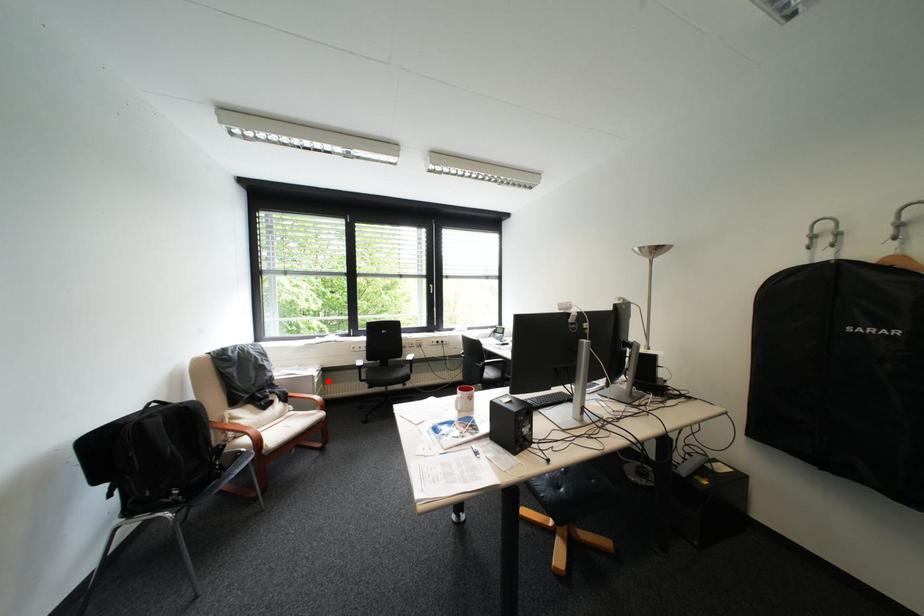
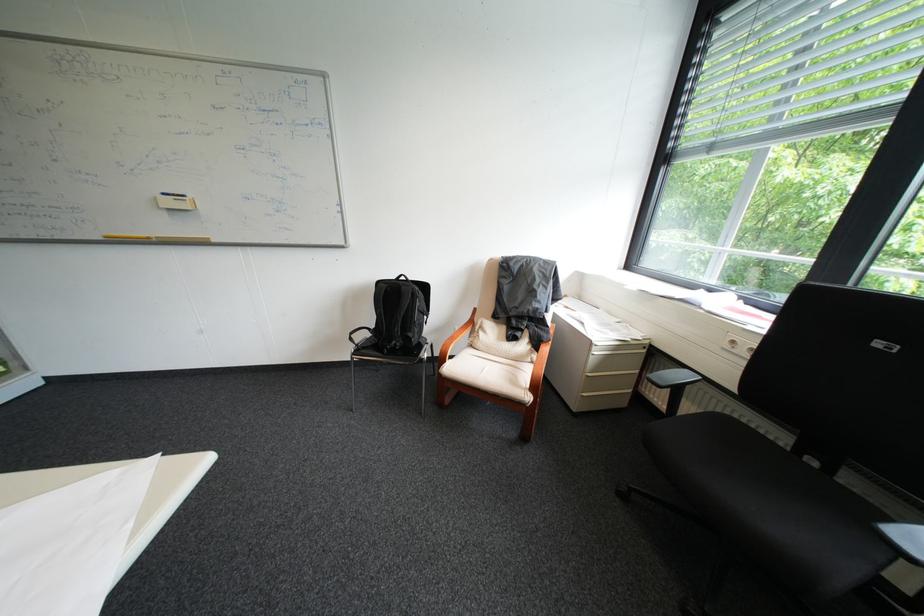
Find the pixel in the second image that matches the highlighted location in the first image.

(609, 353)